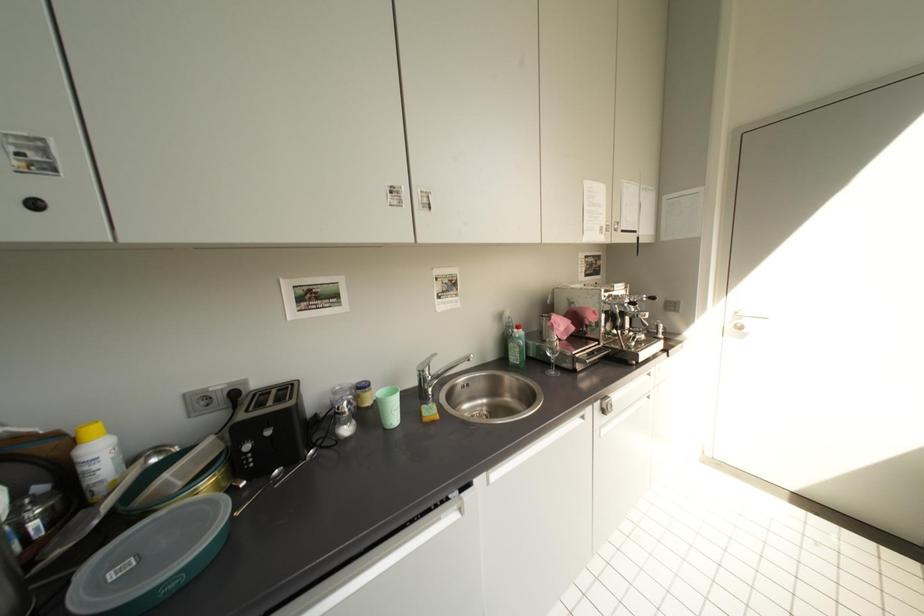
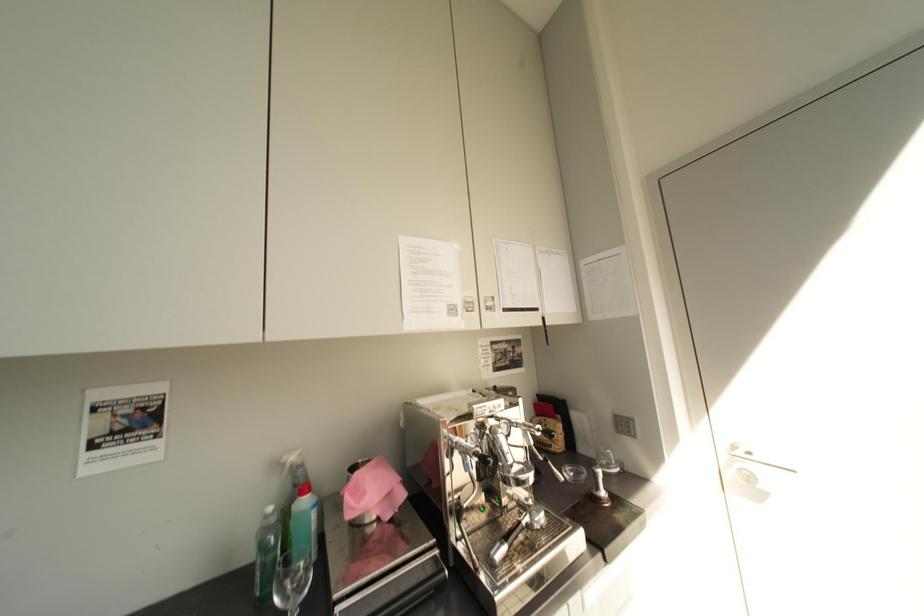
From the picture: Which direction would the cameraman need to move to produce the second image?

The movement direction of the cameraman is right, forward.